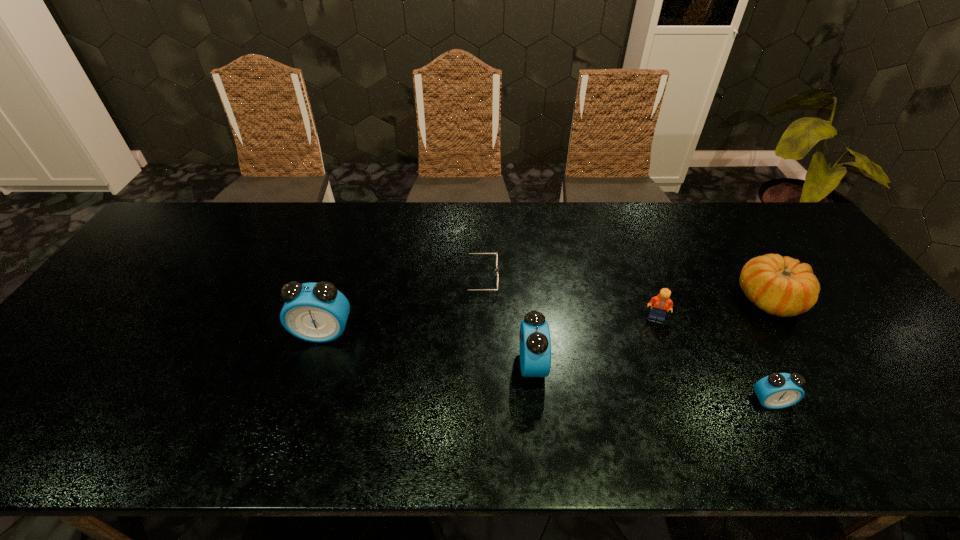
Identify which object is the third nearest to the spectacles. Please provide its 2D coordinates. Your answer should be formatted as a tuple, i.e. [(x, y)], where the tuple contains the x and y coordinates of a point satisfying the conditions above.

[(661, 302)]

This screenshot has width=960, height=540. What are the coordinates of `object that stands as the second closest to the gourd` in the screenshot? It's located at (661, 302).

Select which alarm clock is the closest to the leftmost object. Please provide its 2D coordinates. Your answer should be formatted as a tuple, i.e. [(x, y)], where the tuple contains the x and y coordinates of a point satisfying the conditions above.

[(535, 342)]

Find the location of `the closest alarm clock to the second tallest alarm clock`. the closest alarm clock to the second tallest alarm clock is located at coordinates (317, 312).

This screenshot has width=960, height=540. What are the coordinates of `vacant space that satisfies the following two spatial constraints: 1. on the front-facing side of the second object from left to right; 2. on the face of the leftmost object` in the screenshot? It's located at (471, 333).

The image size is (960, 540). I want to click on vacant position in the image that satisfies the following two spatial constraints: 1. on the front-facing side of the rightmost object; 2. on the left side of the spectacles, so click(471, 300).

Where is `vacant region that satisfies the following two spatial constraints: 1. on the front-facing side of the shortest object; 2. on the back side of the gourd`? vacant region that satisfies the following two spatial constraints: 1. on the front-facing side of the shortest object; 2. on the back side of the gourd is located at coordinates (471, 300).

Find the location of a particular element. Image resolution: width=960 pixels, height=540 pixels. vacant space that satisfies the following two spatial constraints: 1. on the back side of the gourd; 2. on the front-facing side of the fifth object from right to left is located at coordinates (756, 278).

At what (x,y) coordinates should I click in order to perform the action: click on vacant space that satisfies the following two spatial constraints: 1. on the front-facing side of the spectacles; 2. on the face of the leftmost object. Please return your answer as a coordinate pair (x, y). This screenshot has width=960, height=540. Looking at the image, I should click on tap(471, 333).

Find the location of `free space in the image that satisfies the following two spatial constraints: 1. on the front-facing side of the shortest object; 2. on the right side of the rightmost object`. free space in the image that satisfies the following two spatial constraints: 1. on the front-facing side of the shortest object; 2. on the right side of the rightmost object is located at coordinates tap(471, 300).